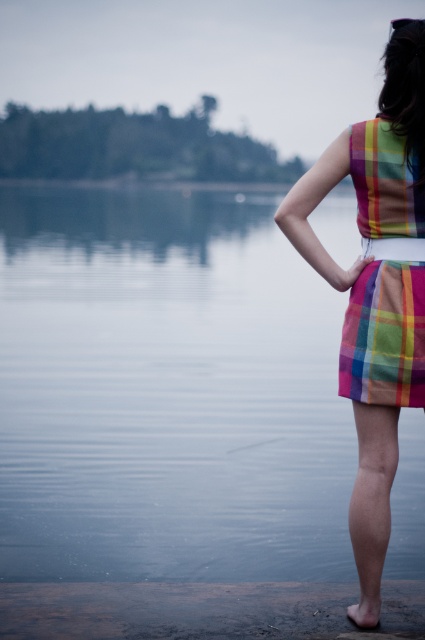
You are a photographer trying to capture the reflection of the plaid fabric dress at center in the transparent water at center. Based on their positions, will the dress be fully visible in the water?

The transparent water at center is taller than plaid fabric dress at center, so the dress will be fully visible in the water since the water extends higher than the dress.

You are a photographer trying to capture the reflection of the plaid fabric dress at center in the transparent water at center. Based on the scene, can you confirm if the dress is positioned below the water to allow its reflection to be visible?

The transparent water at center is located above plaid fabric dress at center, so the dress is positioned below the water, allowing its reflection to be visible in the water.

You are a photographer trying to capture the plaid fabric dress at right in the image. The scene has a point marked at coordinates (373, 291). Where should you focus your camera to ensure the dress is in sharp focus?

You should focus your camera on the point marked at (373, 291) because the plaid fabric dress at right is represented by that point.